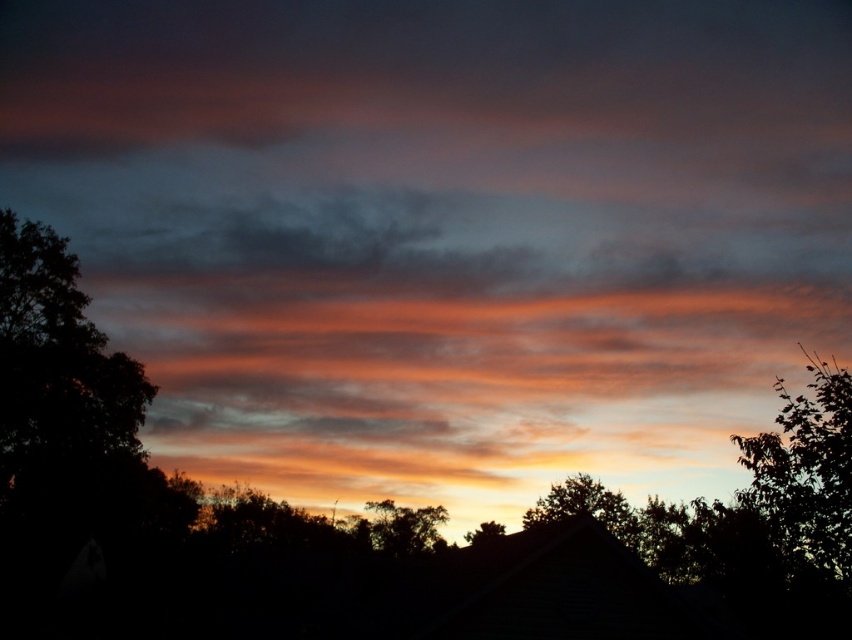
Is dark green leafy tree at left smaller than green leafy tree at right?

Yes, dark green leafy tree at left is smaller than green leafy tree at right.

Where is `dark green leafy tree at left`? The width and height of the screenshot is (852, 640). dark green leafy tree at left is located at coordinates 56,358.

You are a GUI agent. You are given a task and a screenshot of the screen. Output one action in this format:
    pyautogui.click(x=<x>, y=<y>)
    Task: Click on the dark green leafy tree at left
    
    Given the screenshot: What is the action you would take?
    pyautogui.click(x=56, y=358)

This screenshot has width=852, height=640. I want to click on silhouette leafy tree at center, so click(x=403, y=528).

Between point (406, 547) and point (470, 544), which one is positioned behind?

The point (470, 544) is more distant.

The image size is (852, 640). I want to click on silhouette leafy tree at center, so click(x=403, y=528).

Is point (4, 280) less distant than point (491, 534)?

Yes, it is.

Between dark green leafy tree at left and silvery metallic tree at center, which one has more height?

silvery metallic tree at center is taller.

Who is more forward, (62, 296) or (475, 541)?

Point (62, 296) is more forward.

At what (x,y) coordinates should I click in order to perform the action: click on dark green leafy tree at left. Please return your answer as a coordinate pair (x, y). This screenshot has width=852, height=640. Looking at the image, I should click on (56, 358).